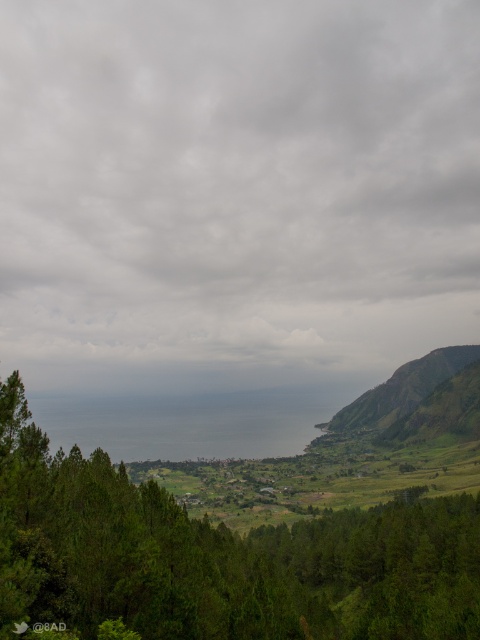
Does cloudy sky at upper center lie in front of green leafy trees at lower left?

No, it is not.

Measure the distance between cloudy sky at upper center and camera.

cloudy sky at upper center and camera are 52.70 meters apart from each other.

Where is `cloudy sky at upper center`? cloudy sky at upper center is located at coordinates (235, 189).